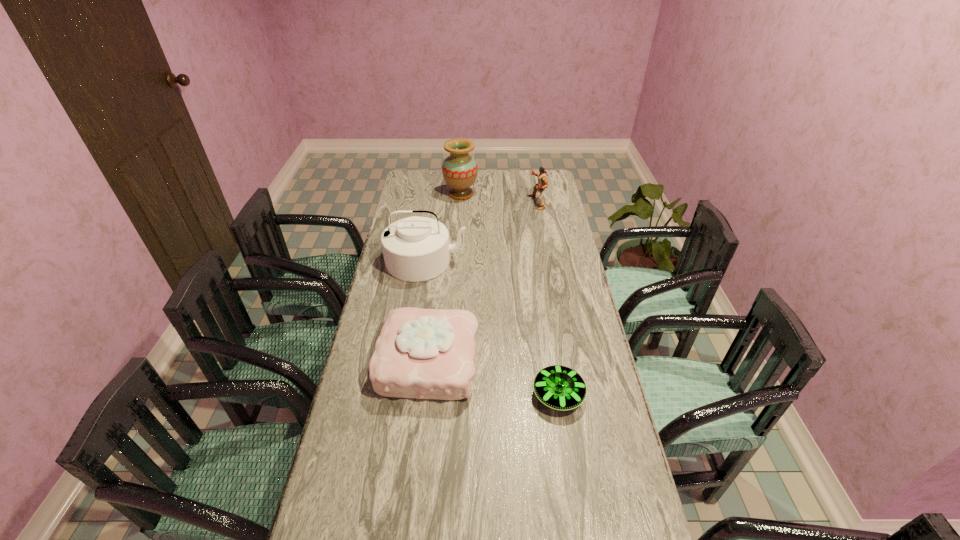
This screenshot has width=960, height=540. I want to click on vacant region located on the back of the second shortest object, so click(438, 266).

This screenshot has width=960, height=540. Identify the location of free space located 0.400m on the back of the shortest object. (541, 288).

Locate an element on the screen. object present at the far edge is located at coordinates (459, 170).

The height and width of the screenshot is (540, 960). What are the coordinates of `kettle positioned at the left edge` in the screenshot? It's located at (415, 249).

The width and height of the screenshot is (960, 540). I want to click on cake located at the left edge, so click(x=421, y=353).

You are a GUI agent. You are given a task and a screenshot of the screen. Output one action in this format:
    pyautogui.click(x=<x>, y=<y>)
    Task: Click on the puncher present at the right edge
    
    Given the screenshot: What is the action you would take?
    pyautogui.click(x=538, y=188)

Image resolution: width=960 pixels, height=540 pixels. In order to click on saucer situated at the right edge in this screenshot , I will do `click(559, 387)`.

This screenshot has height=540, width=960. In order to click on free space at the far edge of the desktop in this screenshot , I will do `click(501, 177)`.

In the image, there is a desktop. What are the coordinates of `vacant region at the left edge` in the screenshot? It's located at (394, 408).

Locate an element on the screen. vacant space at the right edge of the desktop is located at coordinates (577, 523).